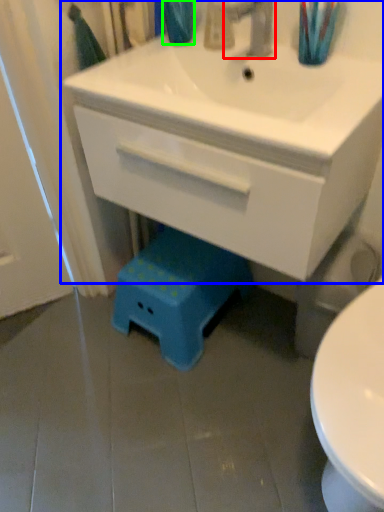
Question: Considering the real-world distances, which object is closest to tap (highlighted by a red box)? bathroom cabinet (highlighted by a blue box) or teal (highlighted by a green box).

Choices:
 (A) bathroom cabinet
 (B) teal

Answer: (B)